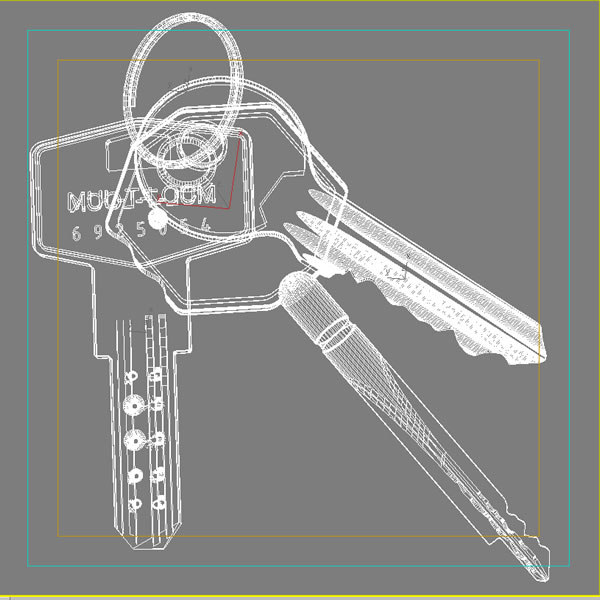
Locate an element on the screen. keys is located at coordinates (137, 341), (368, 360), (415, 270).